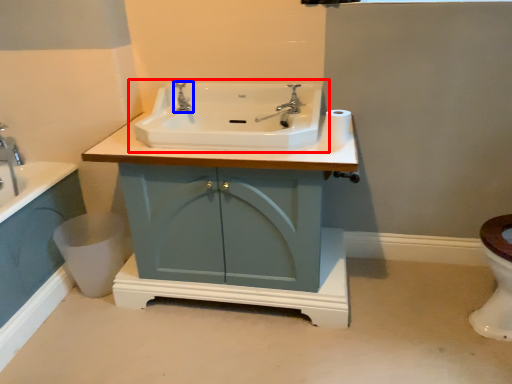
Question: Which point is further to the camera, sink (highlighted by a red box) or tap (highlighted by a blue box)?

Choices:
 (A) sink
 (B) tap

Answer: (B)